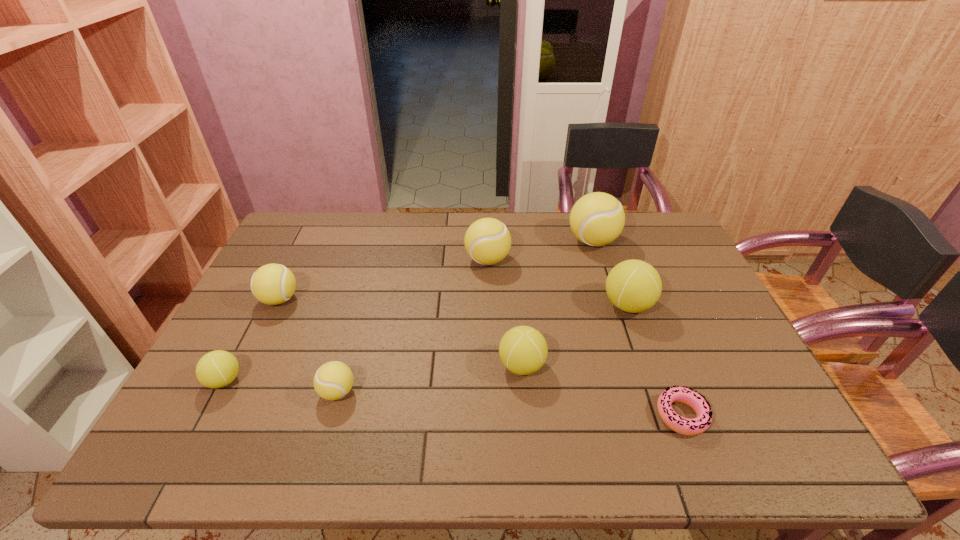
Find the location of a particular element. The width and height of the screenshot is (960, 540). the rightmost yellow tennis ball is located at coordinates (596, 219).

The image size is (960, 540). I want to click on the tallest tennis ball, so click(596, 219).

Find the location of a particular element. This screenshot has height=540, width=960. the third yellow tennis ball from left to right is located at coordinates (487, 241).

Locate an element on the screen. the biggest green tennis ball is located at coordinates (633, 286).

You are a GUI agent. You are given a task and a screenshot of the screen. Output one action in this format:
    pyautogui.click(x=<x>, y=<y>)
    Task: Click on the rightmost green tennis ball
    Image resolution: width=960 pixels, height=540 pixels.
    Given the screenshot: What is the action you would take?
    pyautogui.click(x=633, y=286)

I want to click on the third farthest yellow tennis ball, so click(x=272, y=284).

Where is `the leftmost yellow tennis ball`? This screenshot has height=540, width=960. the leftmost yellow tennis ball is located at coordinates (272, 284).

You are a GUI agent. You are given a task and a screenshot of the screen. Output one action in this format:
    pyautogui.click(x=<x>, y=<y>)
    Task: Click on the second green tennis ball from right to left
    
    Given the screenshot: What is the action you would take?
    pyautogui.click(x=523, y=350)

Where is `the second yellow tennis ball from left to right`? Image resolution: width=960 pixels, height=540 pixels. the second yellow tennis ball from left to right is located at coordinates (333, 380).

The image size is (960, 540). In order to click on the nearest yellow tennis ball in this screenshot , I will do `click(333, 380)`.